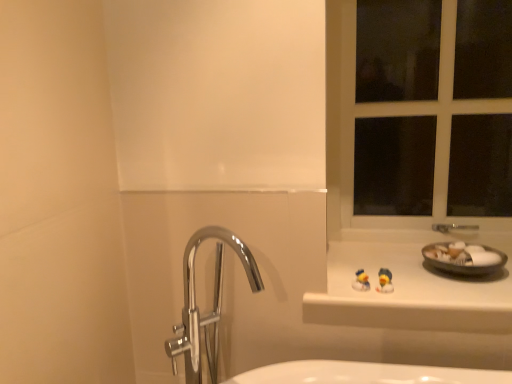
Where is `free space behind yellow rubber duck at center, which appears as the second miniature when viewed from the left`? This screenshot has height=384, width=512. free space behind yellow rubber duck at center, which appears as the second miniature when viewed from the left is located at coordinates (368, 268).